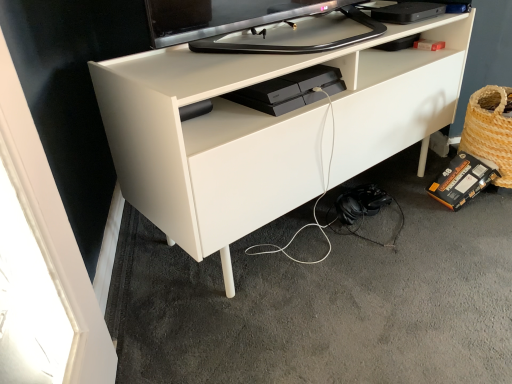
Question: Can we say woven straw basket at lower right lies outside black matte headphones at lower right?

Choices:
 (A) no
 (B) yes

Answer: (B)

Question: From the image's perspective, does woven straw basket at lower right appear higher than black matte headphones at lower right?

Choices:
 (A) no
 (B) yes

Answer: (B)

Question: Is woven straw basket at lower right taller than black matte headphones at lower right?

Choices:
 (A) no
 (B) yes

Answer: (B)

Question: Is woven straw basket at lower right oriented towards black matte headphones at lower right?

Choices:
 (A) no
 (B) yes

Answer: (A)

Question: Is woven straw basket at lower right bigger than black matte headphones at lower right?

Choices:
 (A) no
 (B) yes

Answer: (A)

Question: Is woven straw basket at lower right thinner than black matte headphones at lower right?

Choices:
 (A) no
 (B) yes

Answer: (B)

Question: Is black cardboard box at lower right, the second equipment viewed from the left, positioned with its back to black matte headphones at lower right?

Choices:
 (A) yes
 (B) no

Answer: (B)

Question: Does black cardboard box at lower right, the 2th equipment positioned from the front, turn towards black matte headphones at lower right?

Choices:
 (A) yes
 (B) no

Answer: (B)

Question: Is black cardboard box at lower right, marked as the 1th equipment in a right-to-left arrangement, not near black matte headphones at lower right?

Choices:
 (A) yes
 (B) no

Answer: (B)

Question: Is black cardboard box at lower right, the 2th equipment when ordered from top to bottom, bigger than black matte headphones at lower right?

Choices:
 (A) no
 (B) yes

Answer: (A)

Question: Considering the relative sizes of black cardboard box at lower right, the 1th equipment ordered from the bottom, and black matte headphones at lower right in the image provided, is black cardboard box at lower right, the 1th equipment ordered from the bottom, thinner than black matte headphones at lower right?

Choices:
 (A) yes
 (B) no

Answer: (A)

Question: Considering the relative positions of black cardboard box at lower right, the 2th equipment when ordered from top to bottom, and black matte headphones at lower right in the image provided, is black cardboard box at lower right, the 2th equipment when ordered from top to bottom, to the left of black matte headphones at lower right from the viewer's perspective?

Choices:
 (A) yes
 (B) no

Answer: (B)

Question: Does white matte desk at center have a lesser width compared to black matte headphones at lower right?

Choices:
 (A) yes
 (B) no

Answer: (A)